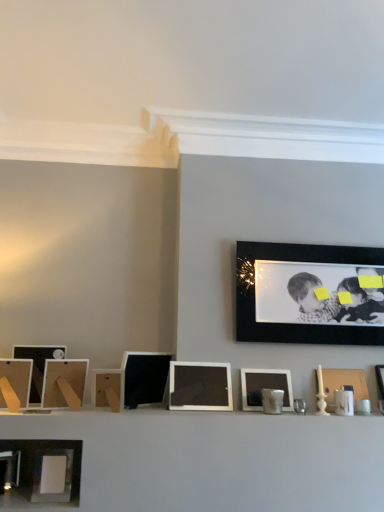
Describe the element at coordinates (144, 378) in the screenshot. I see `matte black picture frame at center, placed as the 5th picture frame when sorted from left to right` at that location.

Locate an element on the screen. matte black picture frame at center, placed as the 5th picture frame when sorted from left to right is located at coordinates (144, 378).

Describe the element at coordinates (107, 389) in the screenshot. I see `wooden at center, which is the 4th picture frame from left to right` at that location.

Locate an element on the screen. matte wooden picture frame at left, marked as the third picture frame in a left-to-right arrangement is located at coordinates (64, 383).

In order to click on matte white picture frame at center, the 7th picture frame from the left in this screenshot , I will do `click(265, 387)`.

Which object is more forward, matte black picture frame at center, which is the 5th picture frame in right-to-left order, or wooden picture frame at right, the ninth picture frame positioned from the left?

matte black picture frame at center, which is the 5th picture frame in right-to-left order.

From the image's perspective, count 3rd picture frames downward from the matte black picture frame at center, which is the 5th picture frame in right-to-left order, and point to it. Please provide its 2D coordinates.

[(343, 384)]

Is wooden picture frame at right, the ninth picture frame positioned from the left, at the back of matte black picture frame at center, which is the 5th picture frame in right-to-left order?

matte black picture frame at center, which is the 5th picture frame in right-to-left order, is not turned away from wooden picture frame at right, the ninth picture frame positioned from the left.

Is black matte picture frame at upper right, the eighth picture frame viewed from the left, wider or thinner than matte black picture frame at left, which is the 9th picture frame from right to left?

Considering their sizes, black matte picture frame at upper right, the eighth picture frame viewed from the left, looks slimmer than matte black picture frame at left, which is the 9th picture frame from right to left.

Would you say matte black picture frame at left, positioned as the first picture frame in left-to-right order, is part of black matte picture frame at upper right, the 2th picture frame from the right,'s contents?

Actually, matte black picture frame at left, positioned as the first picture frame in left-to-right order, is outside black matte picture frame at upper right, the 2th picture frame from the right.

Is black matte picture frame at upper right, the eighth picture frame viewed from the left, to the left or to the right of matte black picture frame at left, which is the 9th picture frame from right to left, in the image?

black matte picture frame at upper right, the eighth picture frame viewed from the left, is positioned on matte black picture frame at left, which is the 9th picture frame from right to left,'s right side.

Is black matte picture frame at upper right, the eighth picture frame viewed from the left, shorter than matte black picture frame at left, which is the 9th picture frame from right to left?

Incorrect, the height of black matte picture frame at upper right, the eighth picture frame viewed from the left, does not fall short of that of matte black picture frame at left, which is the 9th picture frame from right to left.

Image resolution: width=384 pixels, height=512 pixels. I want to click on the 4th picture frame in front of the matte black picture frame at center, placed as the 5th picture frame when sorted from left to right, so click(15, 381).

Is matte black picture frame at center, which is the 5th picture frame in right-to-left order, next to matte black picture frame at left, which is the 9th picture frame from right to left?

They are not placed beside each other.

Can you confirm if matte black picture frame at center, which is the 5th picture frame in right-to-left order, is positioned to the left of matte black picture frame at left, positioned as the first picture frame in left-to-right order?

Incorrect, matte black picture frame at center, which is the 5th picture frame in right-to-left order, is not on the left side of matte black picture frame at left, positioned as the first picture frame in left-to-right order.

Between matte black picture frame at center, which is the 5th picture frame in right-to-left order, and matte black picture frame at left, positioned as the first picture frame in left-to-right order, which one has more height?

With more height is matte black picture frame at center, which is the 5th picture frame in right-to-left order.

Can you confirm if matte wooden picture frame at left, which is the 7th picture frame from right to left, is thinner than matte white picture frame at center, the third picture frame from the right?

No, matte wooden picture frame at left, which is the 7th picture frame from right to left, is not thinner than matte white picture frame at center, the third picture frame from the right.

Considering the positions of objects matte wooden picture frame at left, which is the 7th picture frame from right to left, and matte white picture frame at center, the third picture frame from the right, in the image provided, who is in front, matte wooden picture frame at left, which is the 7th picture frame from right to left, or matte white picture frame at center, the third picture frame from the right,?

matte wooden picture frame at left, which is the 7th picture frame from right to left.

Where is `the 4th picture frame counting from the left of the matte white picture frame at center, the 7th picture frame from the left`? the 4th picture frame counting from the left of the matte white picture frame at center, the 7th picture frame from the left is located at coordinates (64, 383).

Consider the image. Is matte wooden picture frame at left, marked as the third picture frame in a left-to-right arrangement, aimed at matte white picture frame at center, the third picture frame from the right?

No, matte wooden picture frame at left, marked as the third picture frame in a left-to-right arrangement, does not turn towards matte white picture frame at center, the third picture frame from the right.

Does point (341, 380) lie behind point (57, 354)?

Yes, it is.

Image resolution: width=384 pixels, height=512 pixels. In order to click on the 7th picture frame to the left of the wooden picture frame at right, the ninth picture frame positioned from the left, counting from the anchor's position in this screenshot , I will do `click(38, 365)`.

Considering the sizes of objects wooden picture frame at right, the first picture frame from the right, and matte black picture frame at left, acting as the eighth picture frame starting from the right, in the image provided, who is taller, wooden picture frame at right, the first picture frame from the right, or matte black picture frame at left, acting as the eighth picture frame starting from the right,?

matte black picture frame at left, acting as the eighth picture frame starting from the right.

Find the location of a particular element. Image resolution: width=384 pixels, height=512 pixels. picture frame that is the 5th object located below the matte black picture frame at left, positioned as the first picture frame in left-to-right order (from the image's perspective) is located at coordinates [200, 386].

Is the surface of matte black picture frame at left, which is the 9th picture frame from right to left, in direct contact with matte black picture frame at center, the 6th picture frame when ordered from left to right?

matte black picture frame at left, which is the 9th picture frame from right to left, is not next to matte black picture frame at center, the 6th picture frame when ordered from left to right, and they're not touching.

Looking at the image, does matte black picture frame at left, which is the 9th picture frame from right to left, seem bigger or smaller compared to matte black picture frame at center, the 6th picture frame when ordered from left to right?

Considering their sizes, matte black picture frame at left, which is the 9th picture frame from right to left, takes up less space than matte black picture frame at center, the 6th picture frame when ordered from left to right.

Is matte black picture frame at left, which is the 9th picture frame from right to left, oriented away from matte black picture frame at center, which appears as the 4th picture frame when viewed from the right?

No, matte black picture frame at left, which is the 9th picture frame from right to left, is not facing away from matte black picture frame at center, which appears as the 4th picture frame when viewed from the right.

Is black matte picture frame at upper right, the 2th picture frame from the right, positioned far away from matte white picture frame at center, the 7th picture frame from the left?

Actually, black matte picture frame at upper right, the 2th picture frame from the right, and matte white picture frame at center, the 7th picture frame from the left, are a little close together.

Considering the sizes of black matte picture frame at upper right, the 2th picture frame from the right, and matte white picture frame at center, the 7th picture frame from the left, in the image, is black matte picture frame at upper right, the 2th picture frame from the right, taller or shorter than matte white picture frame at center, the 7th picture frame from the left,?

Clearly, black matte picture frame at upper right, the 2th picture frame from the right, is taller compared to matte white picture frame at center, the 7th picture frame from the left.

From the picture: Is black matte picture frame at upper right, the eighth picture frame viewed from the left, further to the viewer compared to matte white picture frame at center, the 7th picture frame from the left?

Yes, it is.

Which object is wider, black matte picture frame at upper right, the 2th picture frame from the right, or matte white picture frame at center, the 7th picture frame from the left?

matte white picture frame at center, the 7th picture frame from the left.

Where is `picture frame that is the 3rd object located above the wooden picture frame at right, the first picture frame from the right (from the image's perspective)`? picture frame that is the 3rd object located above the wooden picture frame at right, the first picture frame from the right (from the image's perspective) is located at coordinates (144, 378).

Where is `picture frame that is the 4th object above the matte black picture frame at left, which is the 9th picture frame from right to left (from a real-world perspective)`? This screenshot has width=384, height=512. picture frame that is the 4th object above the matte black picture frame at left, which is the 9th picture frame from right to left (from a real-world perspective) is located at coordinates (309, 294).

From the image, which object appears to be farther from matte black picture frame at center, which appears as the 4th picture frame when viewed from the right, wooden at center, which is the 4th picture frame from left to right, or wooden picture frame at right, the ninth picture frame positioned from the left?

wooden picture frame at right, the ninth picture frame positioned from the left, is positioned further to the anchor matte black picture frame at center, which appears as the 4th picture frame when viewed from the right.

Looking at the image, which one is located closer to matte black picture frame at center, which is the 5th picture frame in right-to-left order, matte white picture frame at center, the third picture frame from the right, or matte wooden picture frame at left, which is the 7th picture frame from right to left?

The object closer to matte black picture frame at center, which is the 5th picture frame in right-to-left order, is matte wooden picture frame at left, which is the 7th picture frame from right to left.

When comparing their distances from wooden picture frame at right, the first picture frame from the right, does matte black picture frame at center, which is the 5th picture frame in right-to-left order, or matte wooden picture frame at left, marked as the third picture frame in a left-to-right arrangement, seem further?

matte wooden picture frame at left, marked as the third picture frame in a left-to-right arrangement, is positioned further to the anchor wooden picture frame at right, the first picture frame from the right.

From the image, which object appears to be nearer to black matte picture frame at upper right, the eighth picture frame viewed from the left, wooden picture frame at right, the ninth picture frame positioned from the left, or matte black picture frame at center, which appears as the 4th picture frame when viewed from the right?

The object closer to black matte picture frame at upper right, the eighth picture frame viewed from the left, is wooden picture frame at right, the ninth picture frame positioned from the left.

Consider the image. Looking at the image, which one is located closer to black matte picture frame at upper right, the 2th picture frame from the right, matte black picture frame at left, acting as the eighth picture frame starting from the right, or wooden at center, arranged as the sixth picture frame when viewed from the right?

wooden at center, arranged as the sixth picture frame when viewed from the right, is closer to black matte picture frame at upper right, the 2th picture frame from the right.

Based on the photo, when comparing their distances from wooden at center, arranged as the sixth picture frame when viewed from the right, does matte black picture frame at left, the 2th picture frame positioned from the left, or wooden picture frame at right, the first picture frame from the right, seem further?

The object further to wooden at center, arranged as the sixth picture frame when viewed from the right, is wooden picture frame at right, the first picture frame from the right.

From the image, which object appears to be nearer to matte black picture frame at center, which is the 5th picture frame in right-to-left order, wooden picture frame at right, the ninth picture frame positioned from the left, or matte black picture frame at left, which is the 9th picture frame from right to left?

matte black picture frame at left, which is the 9th picture frame from right to left, is closer to matte black picture frame at center, which is the 5th picture frame in right-to-left order.

Based on the photo, when comparing their distances from wooden picture frame at right, the first picture frame from the right, does matte white picture frame at center, the third picture frame from the right, or wooden at center, arranged as the sixth picture frame when viewed from the right, seem further?

wooden at center, arranged as the sixth picture frame when viewed from the right, lies further to wooden picture frame at right, the first picture frame from the right, than the other object.

Image resolution: width=384 pixels, height=512 pixels. In order to click on picture frame between matte black picture frame at center, placed as the 5th picture frame when sorted from left to right, and matte white picture frame at center, the third picture frame from the right, from left to right in this screenshot , I will do point(200,386).

You are a GUI agent. You are given a task and a screenshot of the screen. Output one action in this format:
    pyautogui.click(x=<x>, y=<y>)
    Task: Click on the picture frame between wooden at center, which is the 4th picture frame from left to right, and matte black picture frame at center, which appears as the 4th picture frame when viewed from the right, in the horizontal direction
    Image resolution: width=384 pixels, height=512 pixels.
    Given the screenshot: What is the action you would take?
    pyautogui.click(x=144, y=378)

Image resolution: width=384 pixels, height=512 pixels. Identify the location of picture frame between matte black picture frame at left, acting as the eighth picture frame starting from the right, and wooden at center, arranged as the sixth picture frame when viewed from the right, in the horizontal direction. (64, 383).

Locate an element on the screen. Image resolution: width=384 pixels, height=512 pixels. picture frame situated between matte wooden picture frame at left, which is the 7th picture frame from right to left, and matte black picture frame at center, which is the 5th picture frame in right-to-left order, from left to right is located at coordinates click(x=107, y=389).